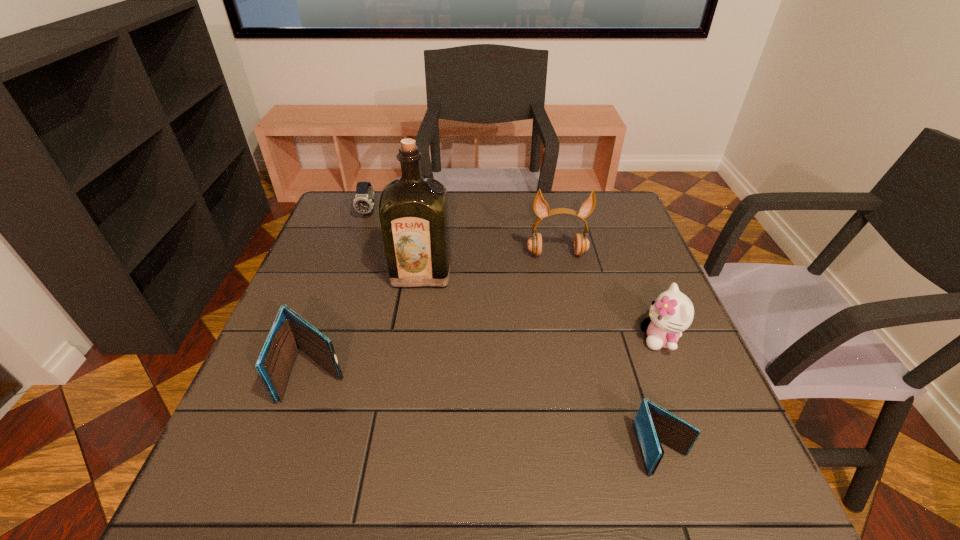
Identify the location of free space for an extra wallet to achieve even spacing. (476, 409).